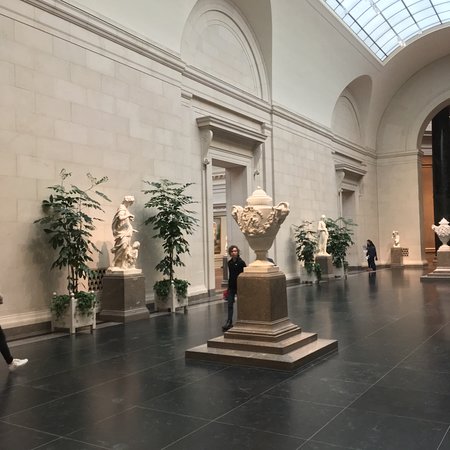
Where is `statue`? This screenshot has width=450, height=450. statue is located at coordinates (122, 229), (322, 233), (395, 236), (443, 234), (260, 230).